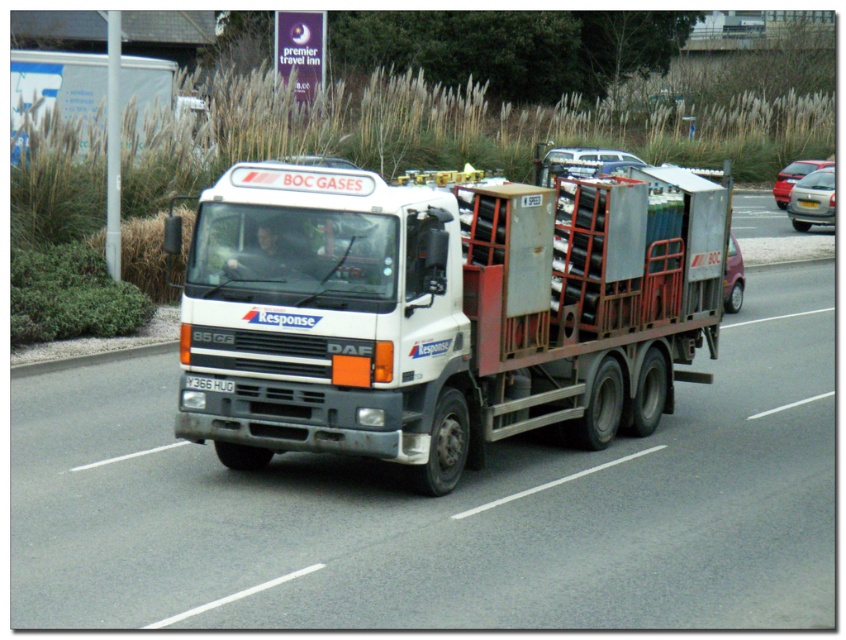
You are standing at the point with coordinates (x=441, y=312) in the image. What object are you standing on?

You are standing on the white matte trailer truck at center.